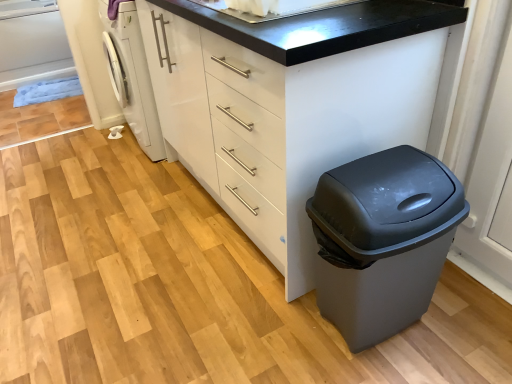
Where is `free space above matte gray plastic trash can at lower right (from a real-world perspective)`? free space above matte gray plastic trash can at lower right (from a real-world perspective) is located at coordinates (378, 170).